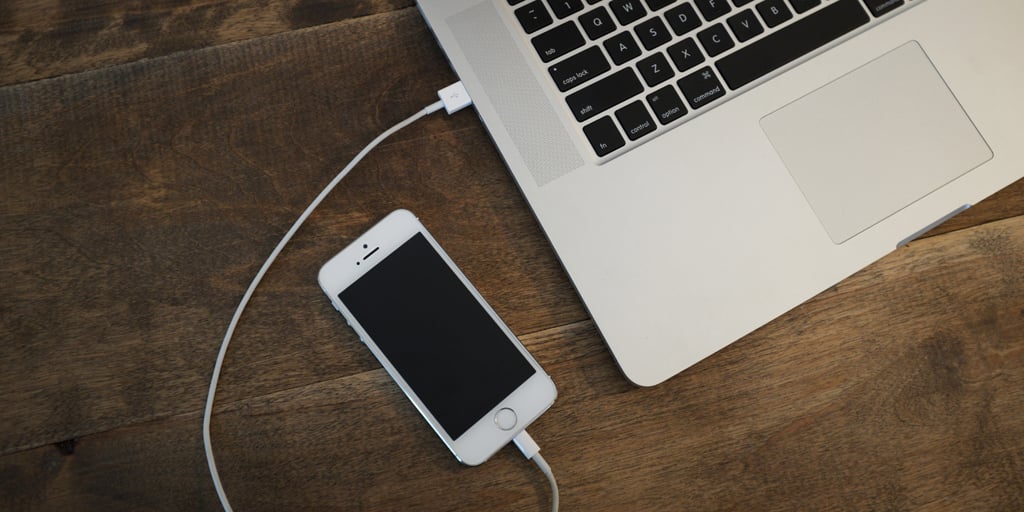
Locate an element on the screen. The image size is (1024, 512). macbook is located at coordinates (701, 203), (455, 6).